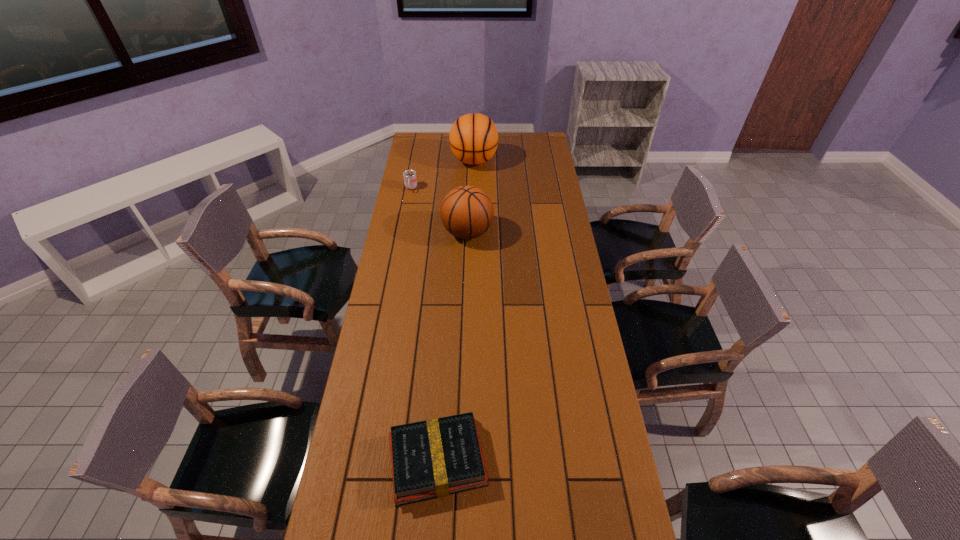
Where is `the farthest object`? The height and width of the screenshot is (540, 960). the farthest object is located at coordinates (473, 138).

You are a GUI agent. You are given a task and a screenshot of the screen. Output one action in this format:
    pyautogui.click(x=<x>, y=<y>)
    Task: Click on the nearer basketball
    This screenshot has height=540, width=960.
    Given the screenshot: What is the action you would take?
    point(467,212)

I want to click on the second shortest object, so click(x=410, y=181).

Locate an element on the screen. the leftmost object is located at coordinates (410, 181).

Where is `hardback book`? This screenshot has height=540, width=960. hardback book is located at coordinates (434, 458).

You are a GUI agent. You are given a task and a screenshot of the screen. Output one action in this format:
    pyautogui.click(x=<x>, y=<y>)
    Task: Click on the shortest object
    Image resolution: width=960 pixels, height=540 pixels.
    Given the screenshot: What is the action you would take?
    pyautogui.click(x=434, y=458)

Find the location of a particular element. free location located on the front of the farther basketball is located at coordinates (473, 191).

Find the location of a particular element. vacant space located 0.400m on the back of the nearer basketball is located at coordinates (469, 168).

What are the coordinates of `vacant point located 0.110m on the side with the handle of the cup` in the screenshot? It's located at (407, 208).

Locate an element on the screen. The image size is (960, 540). blank space located 0.070m on the back of the hardback book is located at coordinates (442, 398).